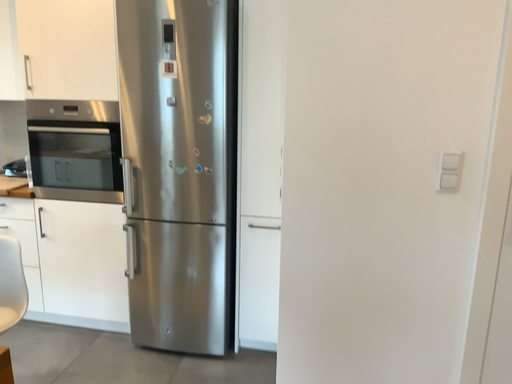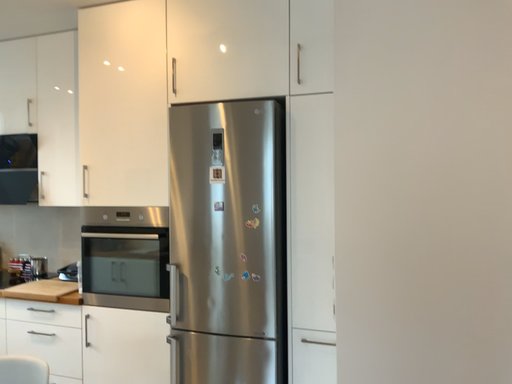
Question: Which way did the camera rotate in the video?

Choices:
 (A) rotated left
 (B) rotated right

Answer: (A)